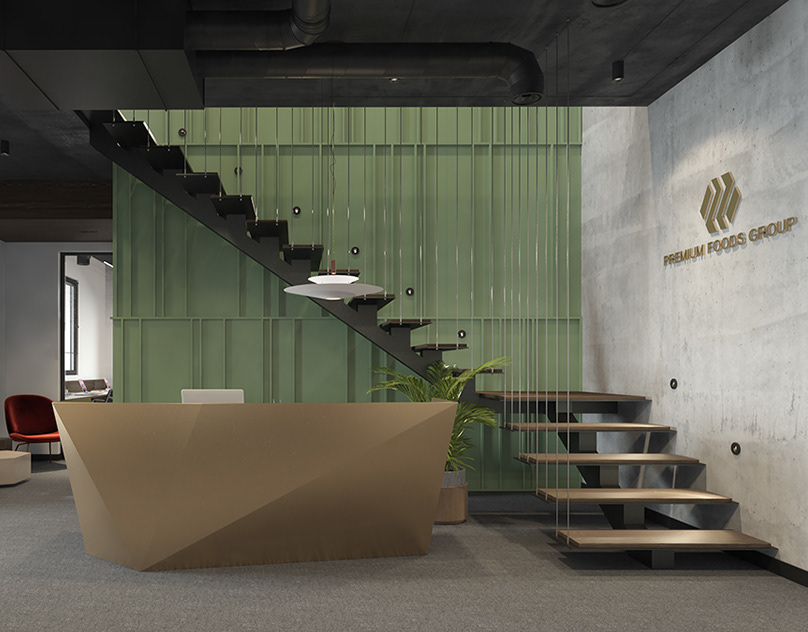
This screenshot has width=808, height=632. Identify the location of floating staircase. (267, 241), (595, 478).